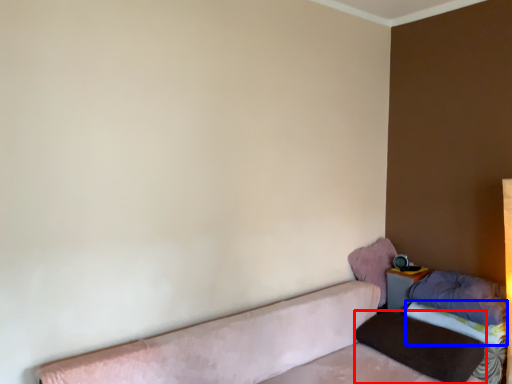
Question: Which of the following is the farthest to the observer, pillow (highlighted by a red box) or sheet (highlighted by a blue box)?

Choices:
 (A) pillow
 (B) sheet

Answer: (B)